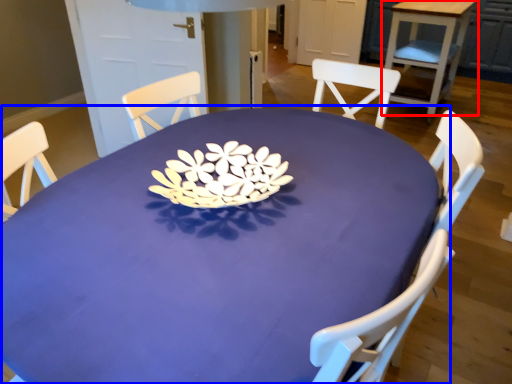
Question: Which point is further to the camera, table (highlighted by a red box) or table (highlighted by a blue box)?

Choices:
 (A) table
 (B) table

Answer: (A)